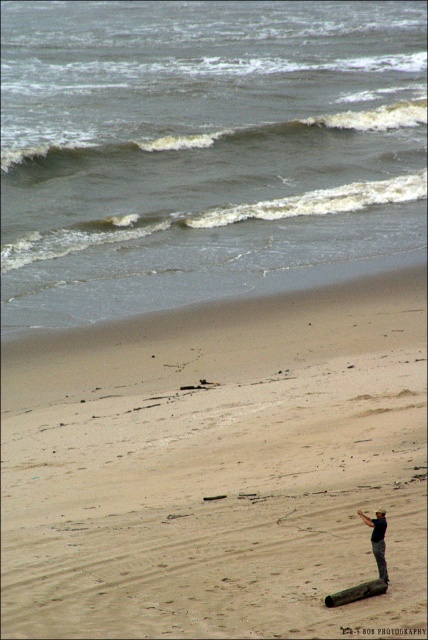
In the scene shown: You are standing on the beach and see two points marked on the sand. The first is at point (205,362) and the second is at point (377,513). Which point is closer to you?

Point (205,362) is closer to you because it is further to the viewer than point (377,513).

You are a photographer trying to capture the beach scene. You want to place a tripod between the dark blue fabric at lower right and the brown wood log at lower right. Which object should the tripod be closer to if you want it to be placed where the ground is higher?

The dark blue fabric at lower right is taller than the brown wood log at lower right, so the tripod should be closer to the dark blue fabric at lower right to be placed on higher ground.